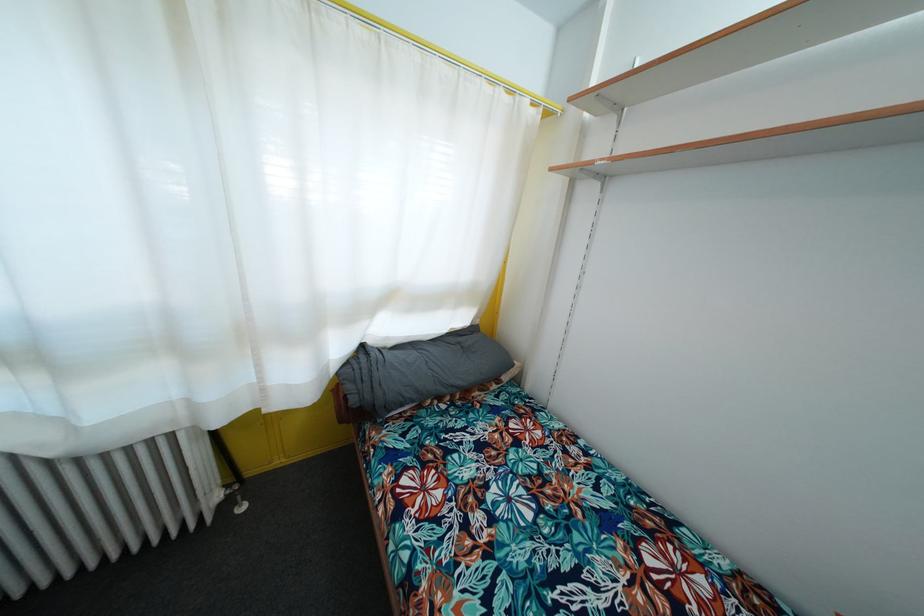
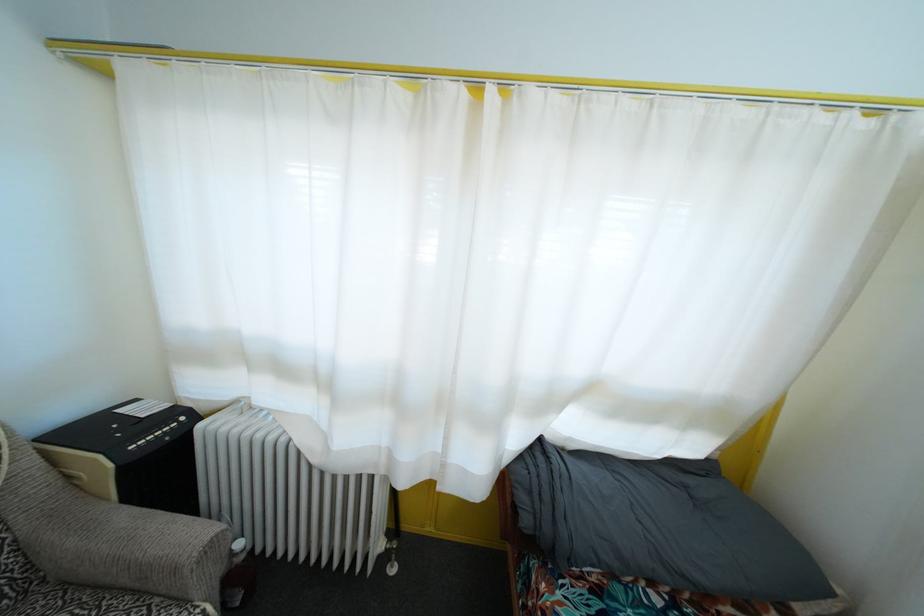
The point at (x=358, y=407) is marked in the first image. Where is the corresponding point in the second image?

(529, 528)